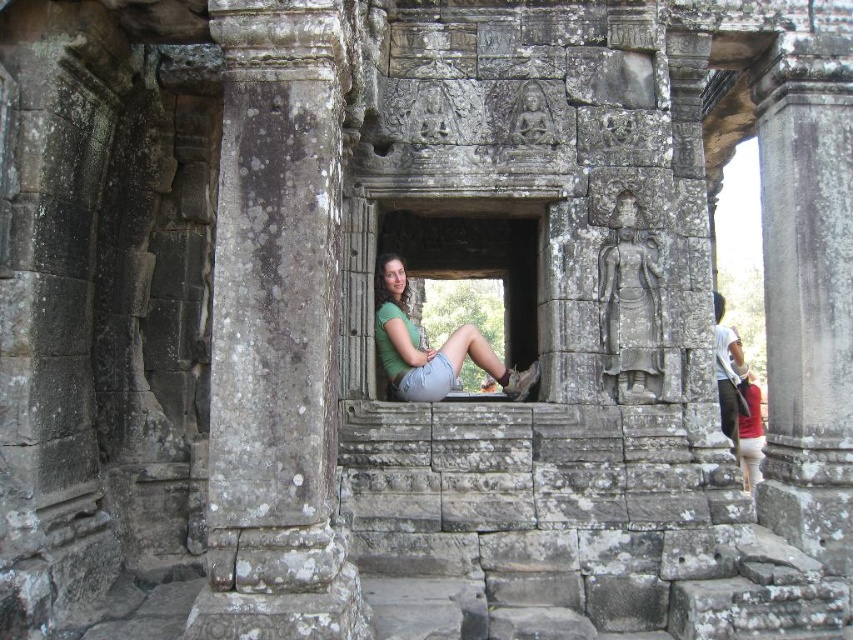
Question: Which is nearer to the green fabric shirt at center?

Choices:
 (A) gray stone pillar at upper right
 (B) matte red shirt at center

Answer: (A)

Question: From the image, what is the correct spatial relationship of gray stone pillar at upper right in relation to white cotton shirt at center?

Choices:
 (A) below
 (B) above

Answer: (B)

Question: Estimate the real-world distances between objects in this image. Which object is closer to the white cotton shirt at center?

Choices:
 (A) gray stone column at left
 (B) matte red shirt at center
 (C) green fabric shirt at center

Answer: (B)

Question: Is gray stone column at left to the right of gray stone pillar at upper right from the viewer's perspective?

Choices:
 (A) yes
 (B) no

Answer: (B)

Question: Is gray stone column at left closer to camera compared to matte red shirt at center?

Choices:
 (A) no
 (B) yes

Answer: (B)

Question: Based on their relative distances, which object is farther from the green fabric shirt at center?

Choices:
 (A) gray stone column at left
 (B) gray stone pillar at upper right
 (C) matte red shirt at center

Answer: (C)